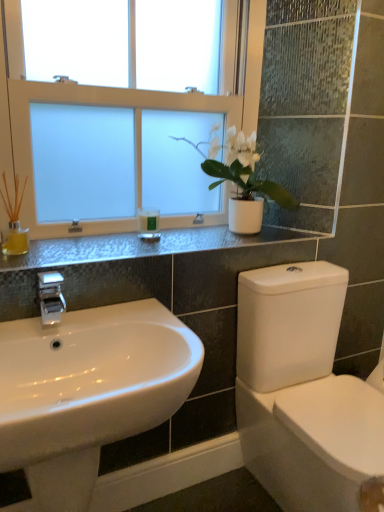
Find the location of `vacant area on top of metallic gray counter top at upper center (from a real-world perspective)`. vacant area on top of metallic gray counter top at upper center (from a real-world perspective) is located at coordinates coord(148,244).